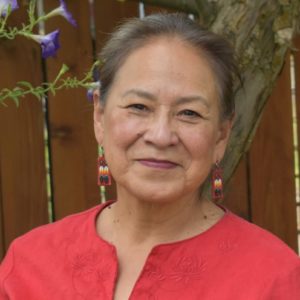
In order to click on the bottom rightmost flower in this screenshot , I will do `click(48, 45)`.